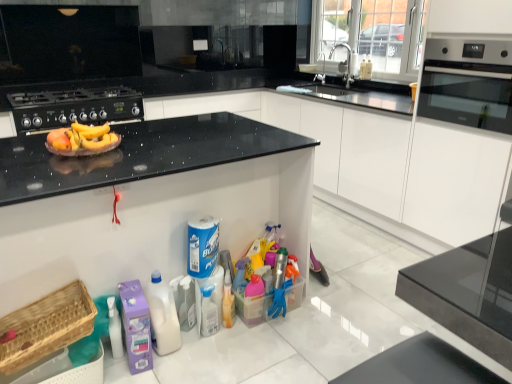
Question: Considering the relative sizes of purple plastic laundry detergent at lower left, the first cleaning product when ordered from left to right, and translucent plastic spray bottle at center in the image provided, is purple plastic laundry detergent at lower left, the first cleaning product when ordered from left to right, bigger than translucent plastic spray bottle at center?

Choices:
 (A) no
 (B) yes

Answer: (B)

Question: Is purple plastic laundry detergent at lower left, which is the 3th cleaning product in right-to-left order, wider than translucent plastic spray bottle at center?

Choices:
 (A) no
 (B) yes

Answer: (B)

Question: Could you tell me if purple plastic laundry detergent at lower left, the first cleaning product when ordered from left to right, is facing translucent plastic spray bottle at center?

Choices:
 (A) yes
 (B) no

Answer: (B)

Question: Is purple plastic laundry detergent at lower left, the first cleaning product when ordered from left to right, closer to the viewer compared to translucent plastic spray bottle at center?

Choices:
 (A) yes
 (B) no

Answer: (A)

Question: Is purple plastic laundry detergent at lower left, the first cleaning product when ordered from left to right, not close to translucent plastic spray bottle at center?

Choices:
 (A) no
 (B) yes

Answer: (A)

Question: From the image's perspective, is silver metallic faucet at upper center, acting as the 2th faucet starting from the front, positioned above or below polished stainless steel faucet at upper right, the first faucet viewed from the front?

Choices:
 (A) above
 (B) below

Answer: (A)

Question: Considering the positions of silver metallic faucet at upper center, acting as the 2th faucet starting from the front, and polished stainless steel faucet at upper right, the first faucet viewed from the front, in the image, is silver metallic faucet at upper center, acting as the 2th faucet starting from the front, wider or thinner than polished stainless steel faucet at upper right, the first faucet viewed from the front,?

Choices:
 (A) wide
 (B) thin

Answer: (B)

Question: From a real-world perspective, is silver metallic faucet at upper center, acting as the 2th faucet starting from the front, physically located above or below polished stainless steel faucet at upper right, the first faucet viewed from the front?

Choices:
 (A) above
 (B) below

Answer: (B)

Question: Is silver metallic faucet at upper center, marked as the first faucet in a back-to-front arrangement, inside the boundaries of polished stainless steel faucet at upper right, the 2th faucet from the back, or outside?

Choices:
 (A) inside
 (B) outside

Answer: (B)

Question: In terms of height, does translucent plastic spray bottle at center look taller or shorter compared to white plastic bottle at lower center, positioned as the second cleaning product in right-to-left order?

Choices:
 (A) tall
 (B) short

Answer: (B)

Question: Is translucent plastic spray bottle at center wider or thinner than white plastic bottle at lower center, positioned as the second cleaning product in right-to-left order?

Choices:
 (A) thin
 (B) wide

Answer: (A)

Question: In the image, is translucent plastic spray bottle at center positioned in front of or behind white plastic bottle at lower center, the second cleaning product viewed from the left?

Choices:
 (A) front
 (B) behind

Answer: (B)

Question: From the image's perspective, is translucent plastic spray bottle at center positioned above or below white plastic bottle at lower center, the second cleaning product viewed from the left?

Choices:
 (A) above
 (B) below

Answer: (B)

Question: From a real-world perspective, is black matte gas stove at upper left above or below translucent plastic spray bottle at center?

Choices:
 (A) above
 (B) below

Answer: (A)

Question: Choose the correct answer: Is black matte gas stove at upper left inside translucent plastic spray bottle at center or outside it?

Choices:
 (A) inside
 (B) outside

Answer: (B)